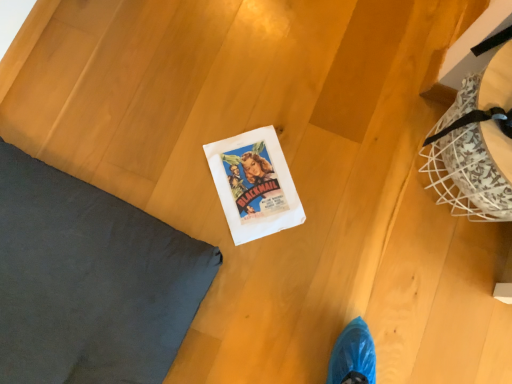
Where is `vacant area on top of white paper comic book at center (from a real-world perspective)`? vacant area on top of white paper comic book at center (from a real-world perspective) is located at coordinates (242, 158).